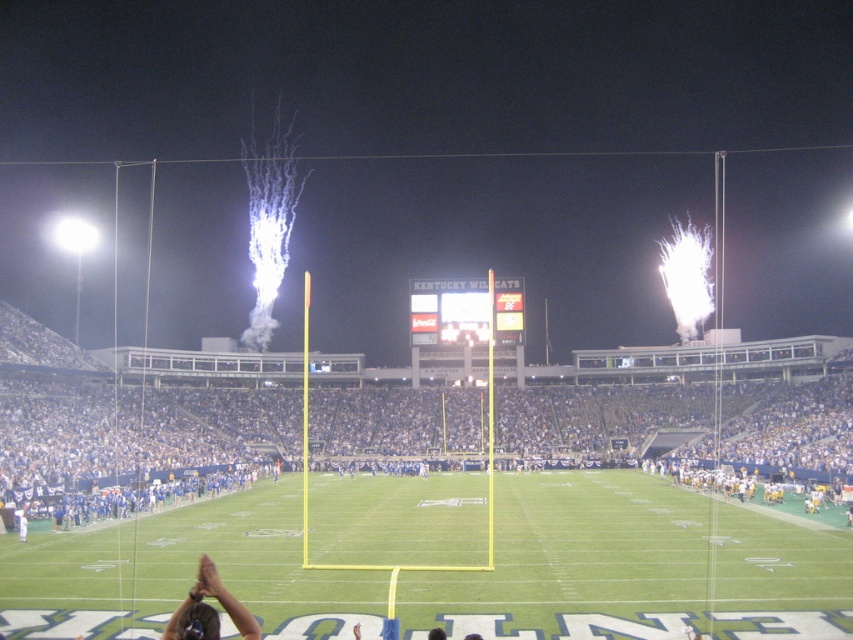
You are a photographer at the stadium. You want to capture a photo that includes both the green artificial turf at center and the dark brown hair at lower left. Which object should you zoom in on to ensure both are clearly visible in the frame?

To ensure both the green artificial turf at center and the dark brown hair at lower left are clearly visible in the frame, you should zoom in on the dark brown hair at lower left since it is smaller than the green artificial turf at center.

You are a photographer standing at the edge of the field. You want to take a photo of the dark brown hair at lower left and the green artificial turf at center. Which object will appear closer to the camera in the photo?

The green artificial turf at center will appear closer to the camera because the dark brown hair at lower left is behind it.